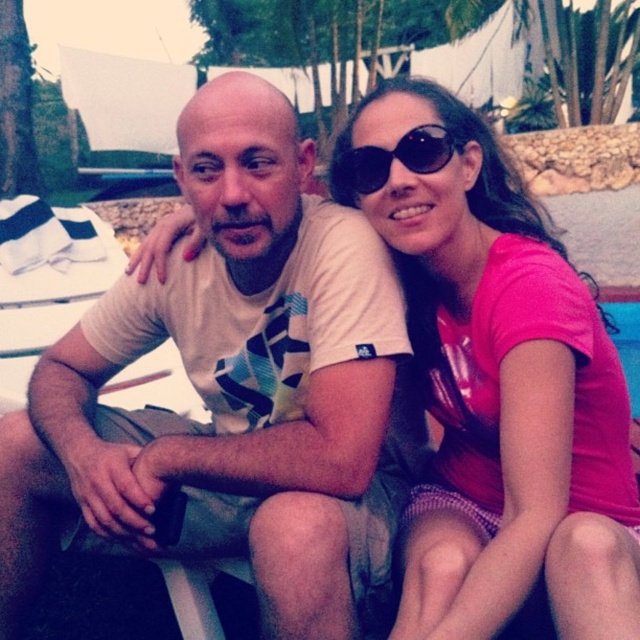
You are a photographer trying to capture a closeup of the woman in the image. You notice two points marked in the scene, point 1 at coordinates point (8,544) and point 2 at coordinates point (476,504). Which point should you focus on to ensure the woman is in sharp focus?

Point (8,544) is closer to the viewer than point (476,504), so focusing on point (8,544) will ensure the woman is in sharp focus.